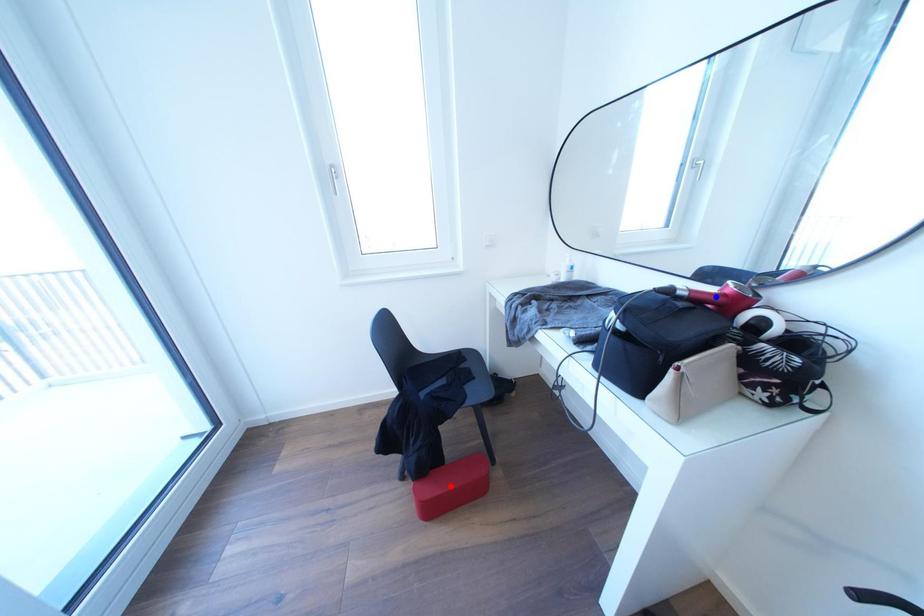
Question: Two points are marked on the image. Which point is closer to the camera?

Choices:
 (A) Blue point is closer.
 (B) Red point is closer.

Answer: (A)